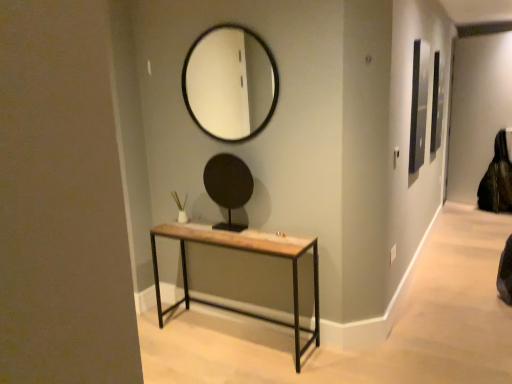
Image resolution: width=512 pixels, height=384 pixels. I want to click on free space to the left of black matte mirror at center, marked as the first mirror in a bottom-to-top arrangement, so [200, 231].